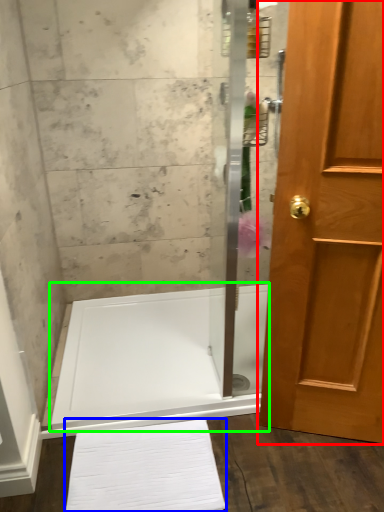
Question: Which object is positioned farthest from door (highlighted by a red box)? Select from bath towel (highlighted by a blue box) and bath (highlighted by a green box).

Choices:
 (A) bath towel
 (B) bath

Answer: (B)